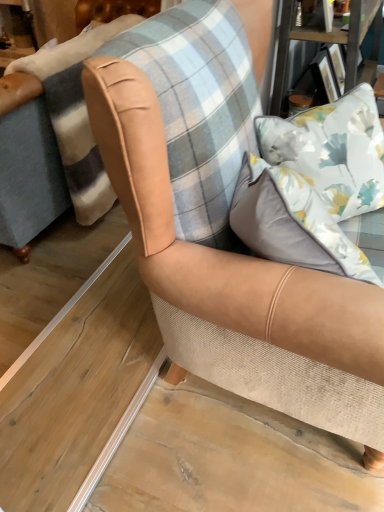
Question: Is white satin pillow at upper right, positioned as the first pillow in front-to-back order, looking in the opposite direction of tan leather armchair at center?

Choices:
 (A) no
 (B) yes

Answer: (A)

Question: Does white satin pillow at upper right, positioned as the second pillow in back-to-front order, appear on the right side of tan leather armchair at center?

Choices:
 (A) yes
 (B) no

Answer: (B)

Question: Is the surface of white satin pillow at upper right, positioned as the first pillow in front-to-back order, in direct contact with tan leather armchair at center?

Choices:
 (A) yes
 (B) no

Answer: (B)

Question: Can you confirm if white satin pillow at upper right, positioned as the second pillow in back-to-front order, is thinner than tan leather armchair at center?

Choices:
 (A) yes
 (B) no

Answer: (A)

Question: Is white satin pillow at upper right, positioned as the second pillow in back-to-front order, facing towards tan leather armchair at center?

Choices:
 (A) yes
 (B) no

Answer: (B)

Question: Is floral fabric pillow at upper right, marked as the first pillow in a back-to-front arrangement, inside or outside of white satin pillow at upper right, positioned as the second pillow in back-to-front order?

Choices:
 (A) inside
 (B) outside

Answer: (B)

Question: Considering the positions of floral fabric pillow at upper right, marked as the first pillow in a back-to-front arrangement, and white satin pillow at upper right, positioned as the second pillow in back-to-front order, in the image, is floral fabric pillow at upper right, marked as the first pillow in a back-to-front arrangement, wider or thinner than white satin pillow at upper right, positioned as the second pillow in back-to-front order,?

Choices:
 (A) wide
 (B) thin

Answer: (A)

Question: Considering the relative positions of floral fabric pillow at upper right, marked as the first pillow in a back-to-front arrangement, and white satin pillow at upper right, positioned as the second pillow in back-to-front order, in the image provided, is floral fabric pillow at upper right, marked as the first pillow in a back-to-front arrangement, to the left or to the right of white satin pillow at upper right, positioned as the second pillow in back-to-front order,?

Choices:
 (A) right
 (B) left

Answer: (A)

Question: Considering the positions of floral fabric pillow at upper right, marked as the first pillow in a back-to-front arrangement, and white satin pillow at upper right, positioned as the first pillow in front-to-back order, in the image, is floral fabric pillow at upper right, marked as the first pillow in a back-to-front arrangement, taller or shorter than white satin pillow at upper right, positioned as the first pillow in front-to-back order,?

Choices:
 (A) tall
 (B) short

Answer: (A)

Question: Is white satin pillow at upper right, positioned as the second pillow in back-to-front order, inside the boundaries of tan leather armchair at center, or outside?

Choices:
 (A) outside
 (B) inside

Answer: (A)

Question: From a real-world perspective, relative to tan leather armchair at center, is white satin pillow at upper right, positioned as the first pillow in front-to-back order, vertically above or below?

Choices:
 (A) below
 (B) above

Answer: (B)

Question: Looking at the image, does white satin pillow at upper right, positioned as the second pillow in back-to-front order, seem bigger or smaller compared to tan leather armchair at center?

Choices:
 (A) big
 (B) small

Answer: (B)

Question: Considering the relative positions of white satin pillow at upper right, positioned as the second pillow in back-to-front order, and tan leather armchair at center in the image provided, is white satin pillow at upper right, positioned as the second pillow in back-to-front order, to the left or to the right of tan leather armchair at center?

Choices:
 (A) left
 (B) right

Answer: (A)

Question: From their relative heights in the image, would you say tan leather armchair at center is taller or shorter than floral fabric pillow at upper right, marked as the first pillow in a back-to-front arrangement?

Choices:
 (A) short
 (B) tall

Answer: (A)

Question: Is point (258, 311) closer or farther from the camera than point (360, 150)?

Choices:
 (A) farther
 (B) closer

Answer: (B)